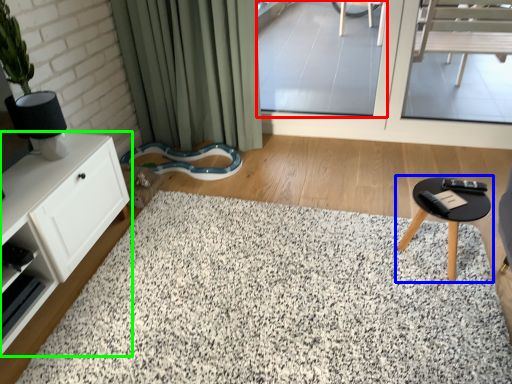
Question: Based on their relative distances, which object is farther from window screen (highlighted by a red box)? Choose from table (highlighted by a blue box) and cabinetry (highlighted by a green box).

Choices:
 (A) table
 (B) cabinetry

Answer: (B)